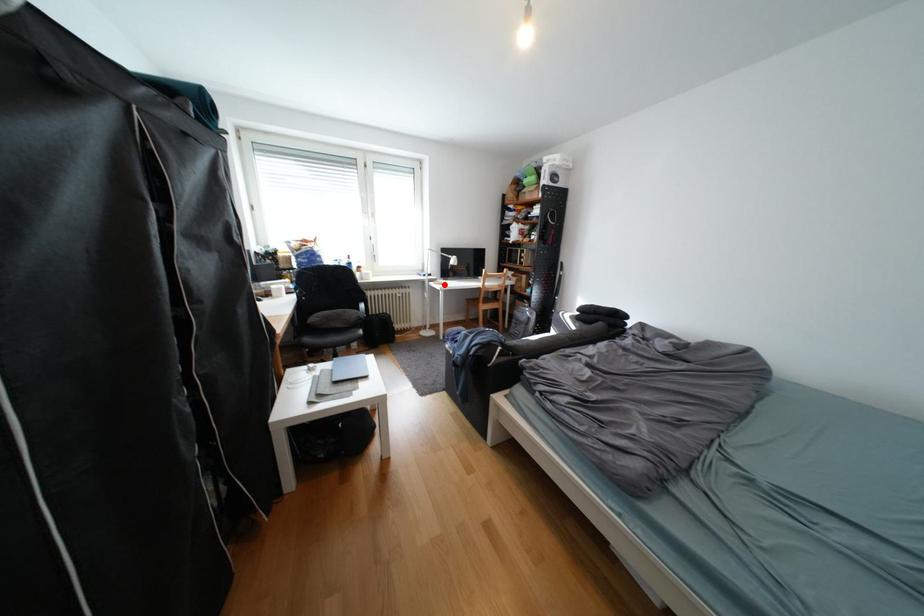
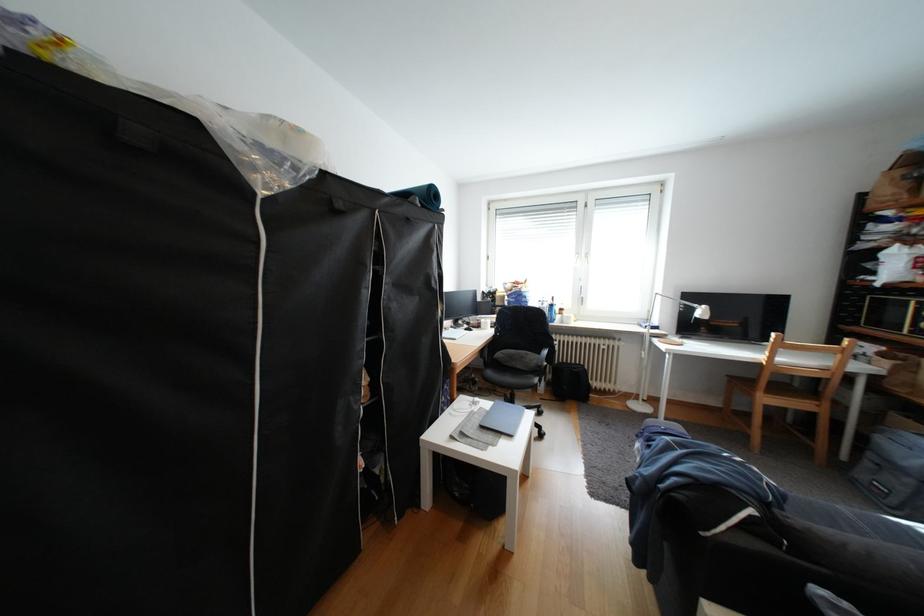
Question: I am providing you with two images of the same scene from different viewpoints. Image1 has a red point marked. In image2, the corresponding 3D location appears at what relative position? Reply with the corresponding letter.

Choices:
 (A) Closer
 (B) Farther

Answer: (B)